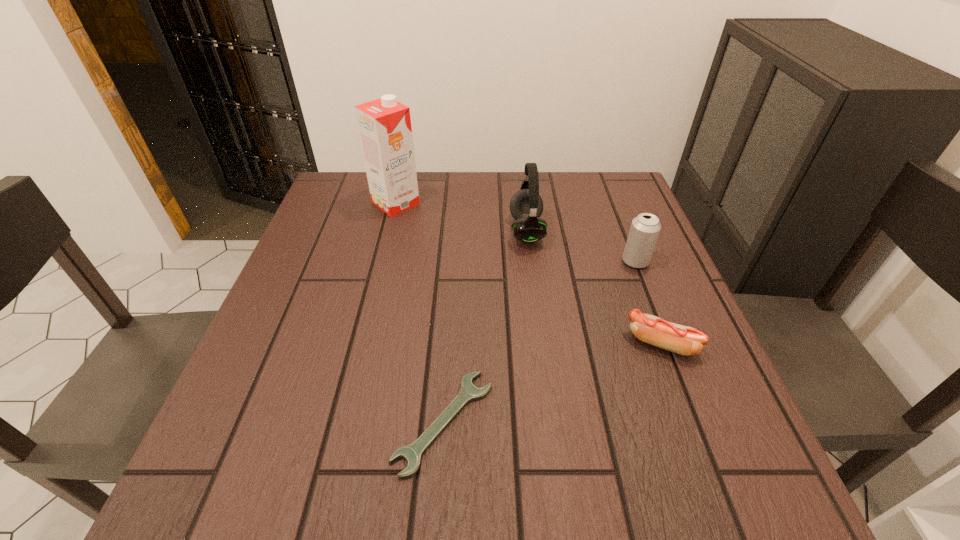
Locate an element on the screen. The width and height of the screenshot is (960, 540). free spot between the third shortest object and the headset is located at coordinates (581, 246).

Image resolution: width=960 pixels, height=540 pixels. Identify the location of blank region between the nearest object and the third tallest object. (540, 341).

The image size is (960, 540). What are the coordinates of `free space between the third farthest object and the fourth farthest object` in the screenshot? It's located at (648, 302).

Where is `free space between the fourth object from right to left and the second tallest object`? The height and width of the screenshot is (540, 960). free space between the fourth object from right to left and the second tallest object is located at coordinates point(485,326).

I want to click on empty space that is in between the third shortest object and the headset, so tap(581, 246).

Find the location of a particular element. The width and height of the screenshot is (960, 540). vacant space that is in between the fourth shortest object and the sausage is located at coordinates (593, 287).

Where is `vacant area that lies between the tallest object and the headset`? vacant area that lies between the tallest object and the headset is located at coordinates (461, 217).

Locate an element on the screen. vacant space that is in between the third tallest object and the sausage is located at coordinates (648, 302).

At what (x,y) coordinates should I click in order to perform the action: click on vacant region between the nearest object and the third object from right to left. Please return your answer as a coordinate pair (x, y). Image resolution: width=960 pixels, height=540 pixels. Looking at the image, I should click on (485, 326).

Identify the location of vacant region between the beer can and the shortest object. This screenshot has width=960, height=540. (540, 341).